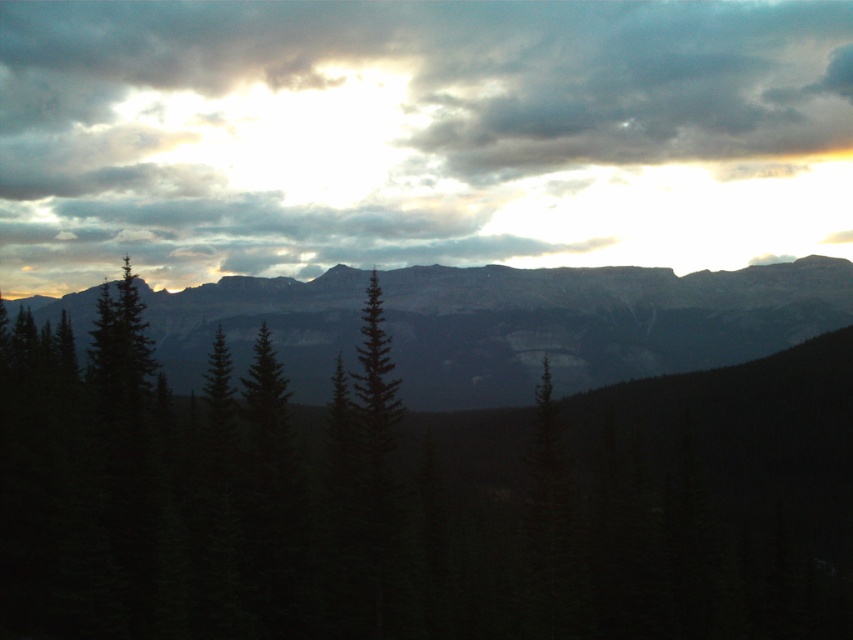
Can you confirm if cloudy sky at upper center is positioned below dark gray rocky mountain range at center?

No.

Is cloudy sky at upper center closer to camera compared to dark gray rocky mountain range at center?

No.

Where is `cloudy sky at upper center`? This screenshot has width=853, height=640. cloudy sky at upper center is located at coordinates (416, 134).

Where is `cloudy sky at upper center`? The width and height of the screenshot is (853, 640). cloudy sky at upper center is located at coordinates (416, 134).

Is dark green pine at center smaller than dark gray rocky mountain range at center?

Yes.

Which is in front, point (683, 324) or point (408, 312)?

Point (408, 312) is in front.

You are a GUI agent. You are given a task and a screenshot of the screen. Output one action in this format:
    pyautogui.click(x=<x>, y=<y>)
    Task: Click on the dark green pine at center
    This screenshot has width=853, height=640.
    Given the screenshot: What is the action you would take?
    pyautogui.click(x=431, y=472)

Is dark green pine at center further to camera compared to cloudy sky at upper center?

No, dark green pine at center is closer to the viewer.

Between point (540, 529) and point (328, 214), which one is positioned behind?

Point (328, 214)

Does point (573, 317) come in front of point (815, 60)?

Yes, it is in front of point (815, 60).

Locate an element on the screen. dark green pine at center is located at coordinates click(x=431, y=472).